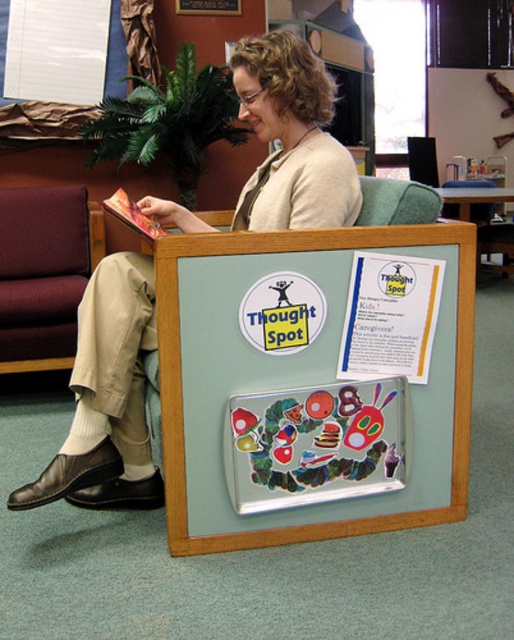
You are a photographer trying to capture a closeup of the caterpillar drawing on the board. You notice two points marked on the board at coordinates point (341, 163) and point (163, 292). Which point should you focus on to ensure the caterpillar is in focus?

You should focus on point (341, 163) because it is closer to the camera than point (163, 292), ensuring the caterpillar drawing will be in focus.

You are a delivery robot with a package that needs to be placed between the light beige sweater at center and the hardcover book at center. The package is 15 inches long. Can you fit it between them without overlapping either object?

The light beige sweater at center and hardcover book at center are 14.84 inches apart from each other. Since the package is 15 inches long, it cannot fit between them without overlapping either object.